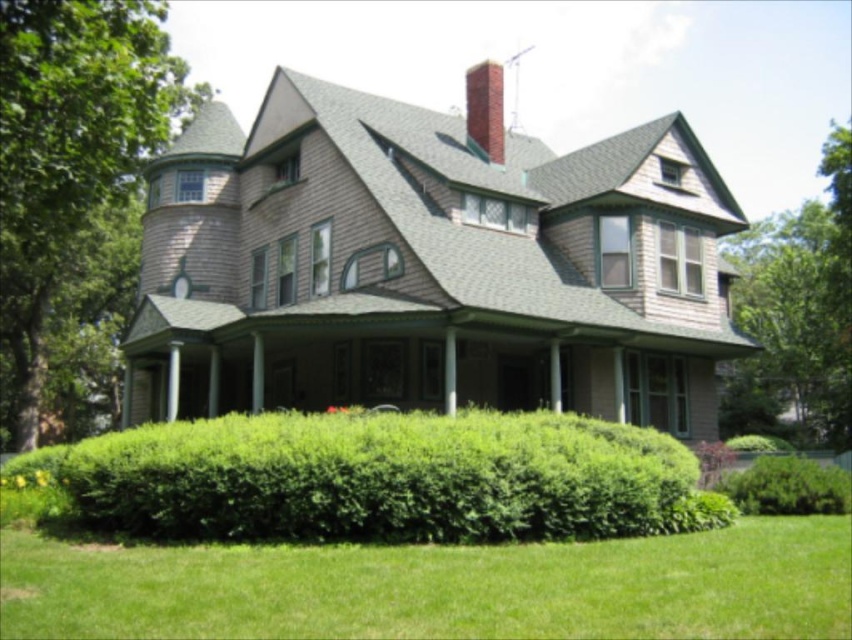
Question: Is green leafy hedge at lower center thinner than red brick chimney at upper center?

Choices:
 (A) yes
 (B) no

Answer: (B)

Question: Which of the following is the farthest from the observer?

Choices:
 (A) red brick chimney at upper center
 (B) green leafy hedge at lower right

Answer: (A)

Question: Does green leafy hedge at lower center have a lesser width compared to green leafy tree at upper right?

Choices:
 (A) yes
 (B) no

Answer: (A)

Question: Which point is closer to the camera?

Choices:
 (A) green leafy tree at upper right
 (B) green leafy hedge at lower center
 (C) green leafy hedge at lower right
 (D) red brick chimney at upper center

Answer: (B)

Question: Can you confirm if green grass at lower center is wider than green leafy tree at left?

Choices:
 (A) yes
 (B) no

Answer: (B)

Question: Estimate the real-world distances between objects in this image. Which object is farther from the red brick chimney at upper center?

Choices:
 (A) green leafy tree at left
 (B) green grass at lower center
 (C) green leafy tree at upper right

Answer: (C)